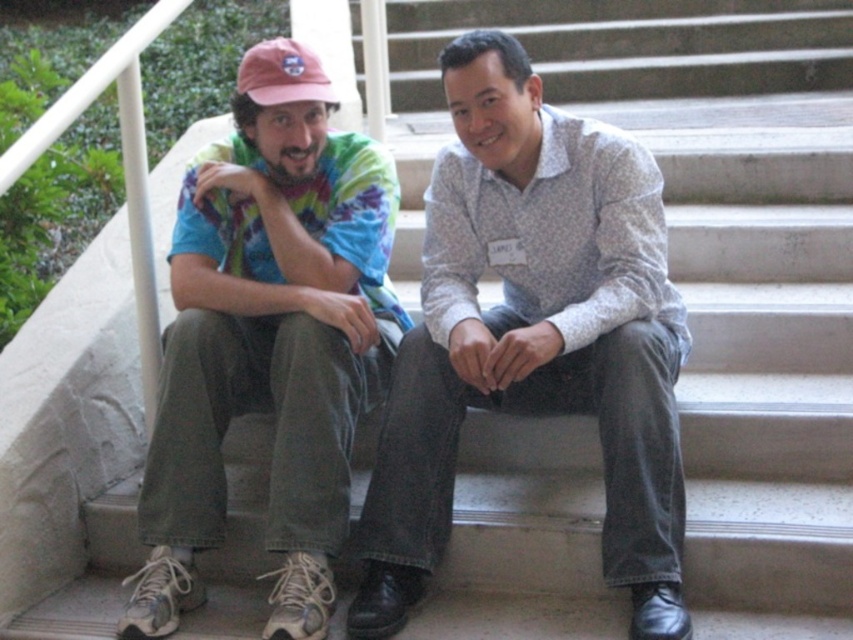
Is tie-dye fabric shirt at left taller than pink fabric baseball cap at upper left?

Yes, tie-dye fabric shirt at left is taller than pink fabric baseball cap at upper left.

Who is lower down, tie-dye fabric shirt at left or pink fabric baseball cap at upper left?

Positioned lower is tie-dye fabric shirt at left.

This screenshot has height=640, width=853. Describe the element at coordinates (268, 353) in the screenshot. I see `tie-dye fabric shirt at left` at that location.

Locate an element on the screen. This screenshot has height=640, width=853. tie-dye fabric shirt at left is located at coordinates (268, 353).

Between point (659, 560) and point (235, 141), which one is positioned behind?

Positioned behind is point (235, 141).

Is point (624, 152) positioned in front of point (173, 406)?

Yes, point (624, 152) is closer to viewer.

Locate an element on the screen. white textured shirt at center is located at coordinates (532, 336).

Can you confirm if white textured shirt at center is thinner than pink fabric baseball cap at upper left?

In fact, white textured shirt at center might be wider than pink fabric baseball cap at upper left.

You are a GUI agent. You are given a task and a screenshot of the screen. Output one action in this format:
    pyautogui.click(x=<x>, y=<y>)
    Task: Click on the white textured shirt at center
    This screenshot has width=853, height=640.
    Given the screenshot: What is the action you would take?
    pyautogui.click(x=532, y=336)

Is point (618, 465) positioned in front of point (263, 65)?

Yes, point (618, 465) is closer to viewer.

Find the location of a particular element. The image size is (853, 640). white textured shirt at center is located at coordinates (532, 336).